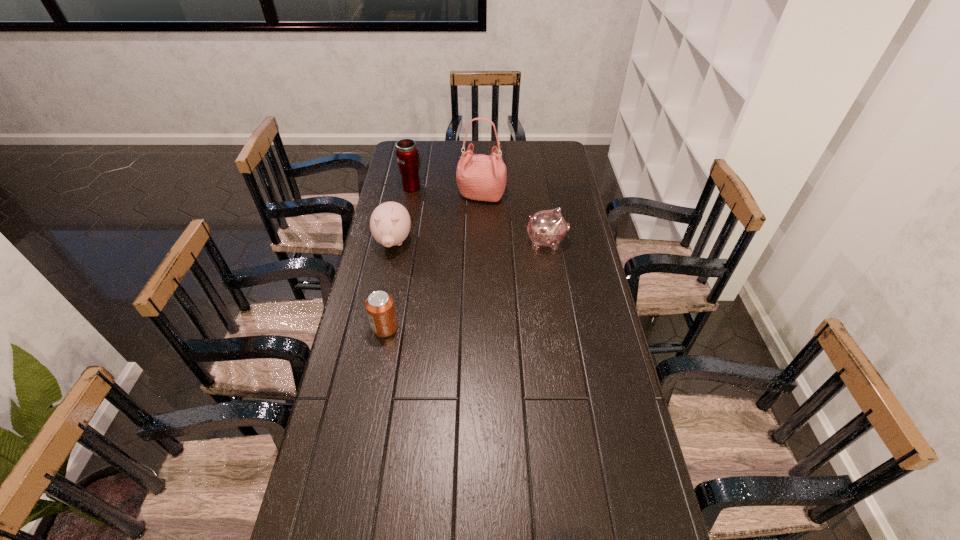
You are a GUI agent. You are given a task and a screenshot of the screen. Output one action in this format:
    pyautogui.click(x=<x>, y=<y>)
    Task: Click on the free space located at the snout of the left piggy bank
    This screenshot has width=960, height=540.
    Given the screenshot: What is the action you would take?
    pyautogui.click(x=384, y=285)

Image resolution: width=960 pixels, height=540 pixels. Identify the location of free space located 0.260m on the right of the can. (479, 328).

Where is `thermos bottle present at the left edge`? thermos bottle present at the left edge is located at coordinates (409, 159).

At what (x,y) coordinates should I click in order to perform the action: click on piggy bank that is positioned at the left edge. Please return your answer as a coordinate pair (x, y). Looking at the image, I should click on (390, 223).

The width and height of the screenshot is (960, 540). I want to click on can that is positioned at the left edge, so click(380, 307).

Find the location of a particular element. The height and width of the screenshot is (540, 960). object present at the right edge is located at coordinates (548, 228).

This screenshot has height=540, width=960. In the image, there is a desktop. In order to click on vacant region at the left edge in this screenshot , I will do `click(405, 198)`.

I want to click on vacant area at the right edge, so click(x=582, y=326).

Locate an element on the screen. free location at the far left corner of the desktop is located at coordinates (420, 141).

The height and width of the screenshot is (540, 960). Identify the location of free spot at the far right corner of the desktop. coord(553,152).